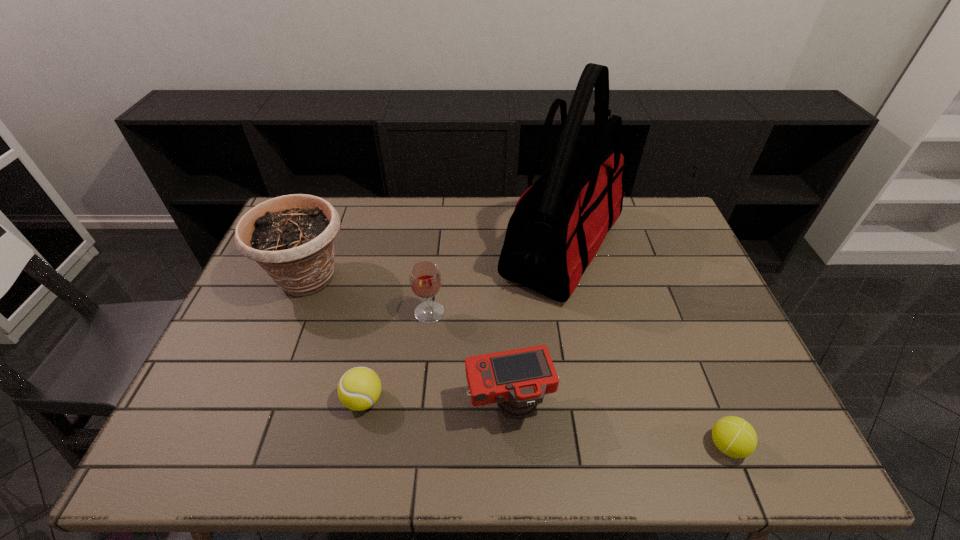
Where is `object that is at the near right corner`? Image resolution: width=960 pixels, height=540 pixels. object that is at the near right corner is located at coordinates (733, 436).

In the image, there is a desktop. Identify the location of free region at the far edge. Image resolution: width=960 pixels, height=540 pixels. (365, 229).

Where is `free space at the near edge of the desktop`? free space at the near edge of the desktop is located at coordinates (601, 460).

At what (x,y) coordinates should I click in order to perform the action: click on free spot at the left edge of the desktop. Please return your answer as a coordinate pair (x, y). This screenshot has height=540, width=960. Looking at the image, I should click on (229, 339).

What are the coordinates of `free region at the right edge` in the screenshot? It's located at (650, 247).

Where is `free point at the far right corner`? The image size is (960, 540). free point at the far right corner is located at coordinates (654, 208).

The width and height of the screenshot is (960, 540). I want to click on empty location between the fifth object from right to left and the leftmost object, so click(x=336, y=339).

Find the location of a particular element. This screenshot has height=540, width=960. free area in between the nearer tennis ball and the camera is located at coordinates (618, 425).

Locate an element on the screen. vacant area that lies between the farther tennis ball and the third object from left to right is located at coordinates (396, 356).

Find the location of `vacant area that lies between the third object from left to right and the nearer tennis ball`. vacant area that lies between the third object from left to right and the nearer tennis ball is located at coordinates (578, 379).